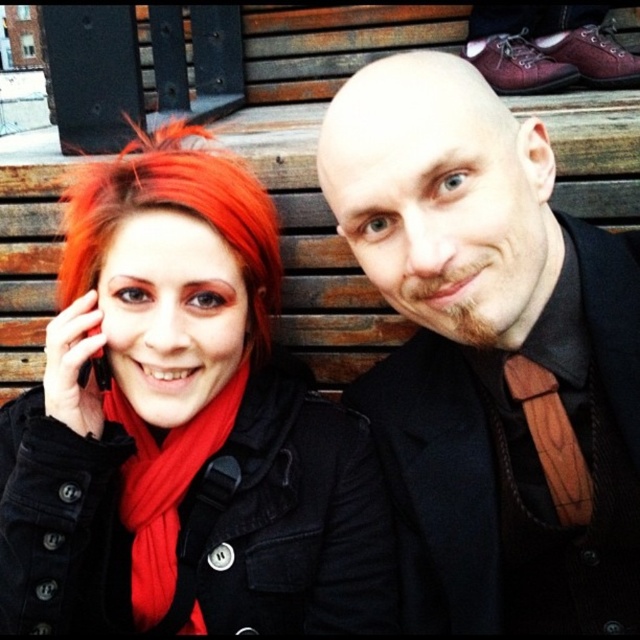
You are a photographer standing 2 meters away from the two people on the bench. You want to take a photo of the matte black coat at left and the shiny red hair at left without any overlap between them. Given that your camera has a minimum focus distance of 2 meters, can you capture both objects clearly in the same frame?

The matte black coat at left and the shiny red hair at left are 19.98 centimeters apart. Since the camera can focus at 2 meters, which is farther than the distance between the objects, both can be in focus. However, the question is about avoiding overlap. The distance between them is 19.98 cm, but their sizes and the camera angle determine overlap. The description doesn

You are a photographer setting up for a group photo. You notice two black garments in the scene, the matte black jacket at center and the matte black coat at left. Which one is positioned higher in the image?

The matte black jacket at center is positioned higher in the image than the matte black coat at left.

You are taking a photo of the two people on the bench. The shiny red hair at left and the red soft scarf at left are both in the frame. Which one is positioned more to the left side of the photo?

The shiny red hair at left is positioned more to the left side of the photo than the red soft scarf at left.